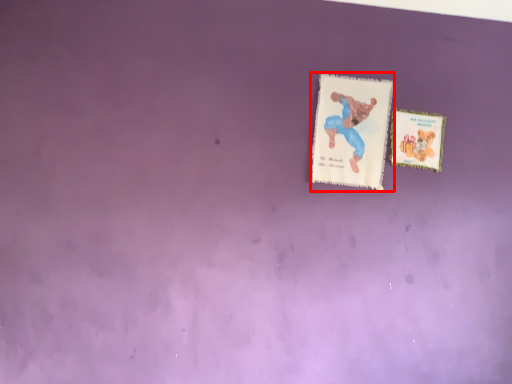
Question: From the image's perspective, what is the correct spatial relationship of card (annotated by the red box) in relation to card?

Choices:
 (A) below
 (B) above

Answer: (B)